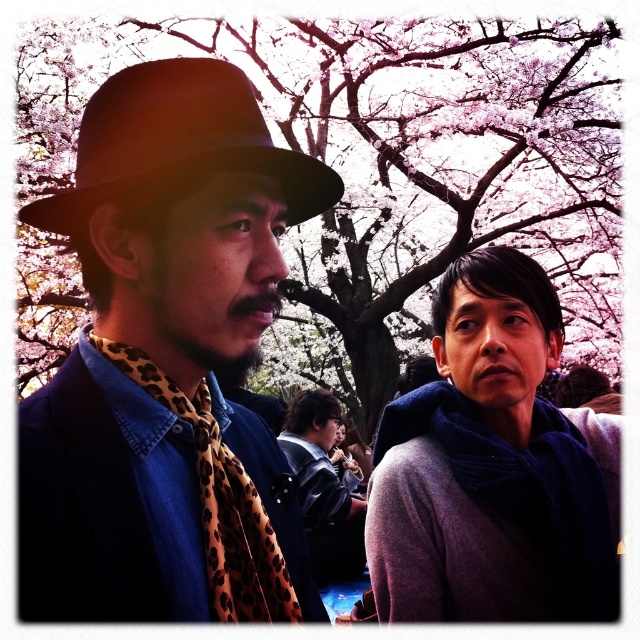
You are a photographer setting up a tripod in the center of the scene. You need to place a small light on the object that is taller between the dark gray sweater at center and the black felt fedora at left. Which object should you place the light on?

The dark gray sweater at center is taller than the black felt fedora at left, so you should place the light on the dark gray sweater at center.

You are a photographer trying to capture both the matte black hat at left and the black felt fedora at left in a single shot. However, you notice that one is blocking the other. Which object is currently obscuring the other?

The matte black hat at left is in front of the black felt fedora at left, so it is obscuring the fedora.